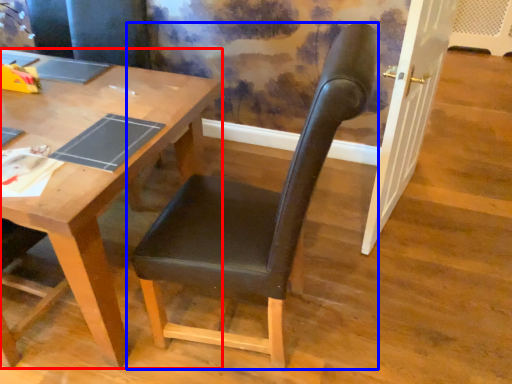
Question: Which object appears farthest to the camera in this image, desk (highlighted by a red box) or chair (highlighted by a blue box)?

Choices:
 (A) desk
 (B) chair

Answer: (A)